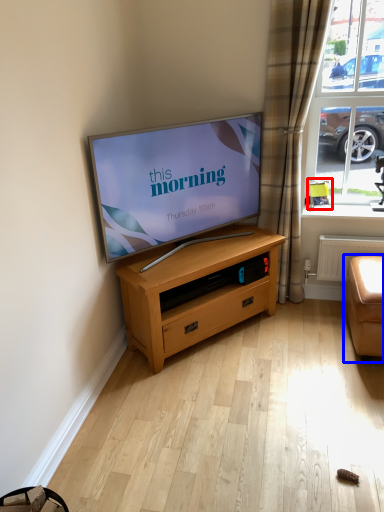
Question: Which object is further to the camera taking this photo, armchair (highlighted by a red box) or studio couch (highlighted by a blue box)?

Choices:
 (A) armchair
 (B) studio couch

Answer: (A)